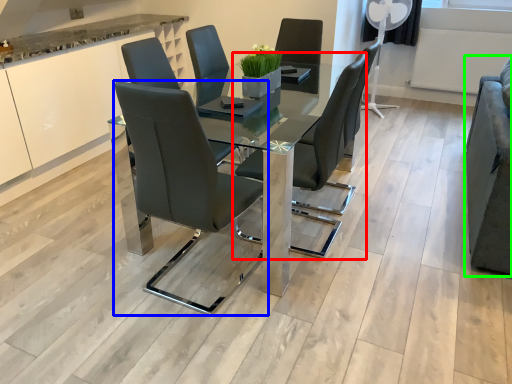
Question: Considering the real-world distances, which object is closest to chair (highlighted by a red box)? chair (highlighted by a blue box) or armchair (highlighted by a green box).

Choices:
 (A) chair
 (B) armchair

Answer: (A)